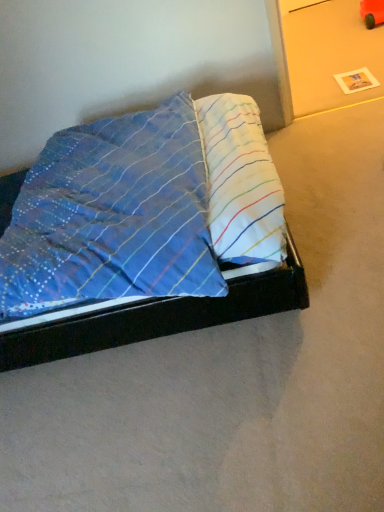
Image resolution: width=384 pixels, height=512 pixels. What do you see at coordinates (144, 232) in the screenshot?
I see `blue striped fabric bed at center` at bounding box center [144, 232].

Identify the location of blue striped fabric bed at center. This screenshot has width=384, height=512. (144, 232).

Where is `blue striped fabric bed at center`? The height and width of the screenshot is (512, 384). blue striped fabric bed at center is located at coordinates (144, 232).